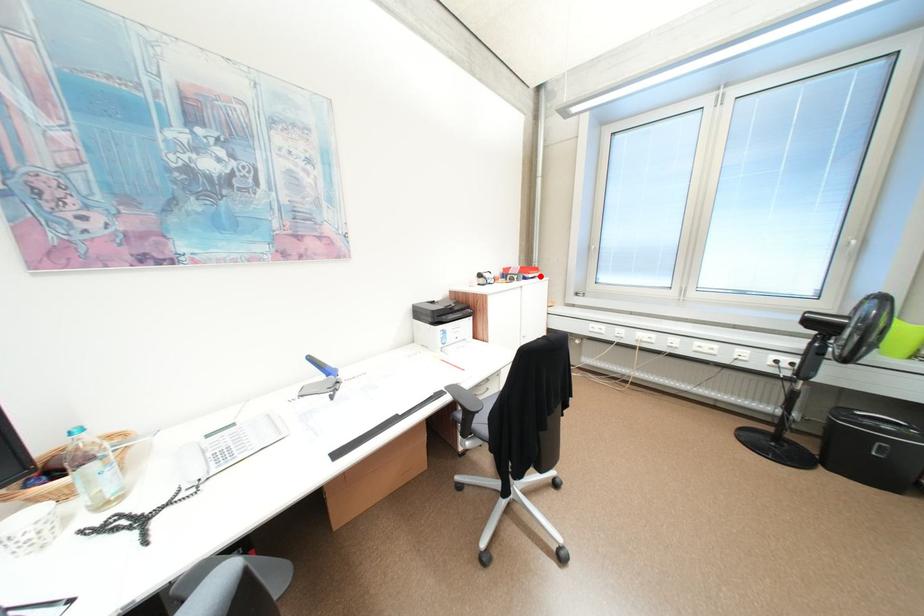
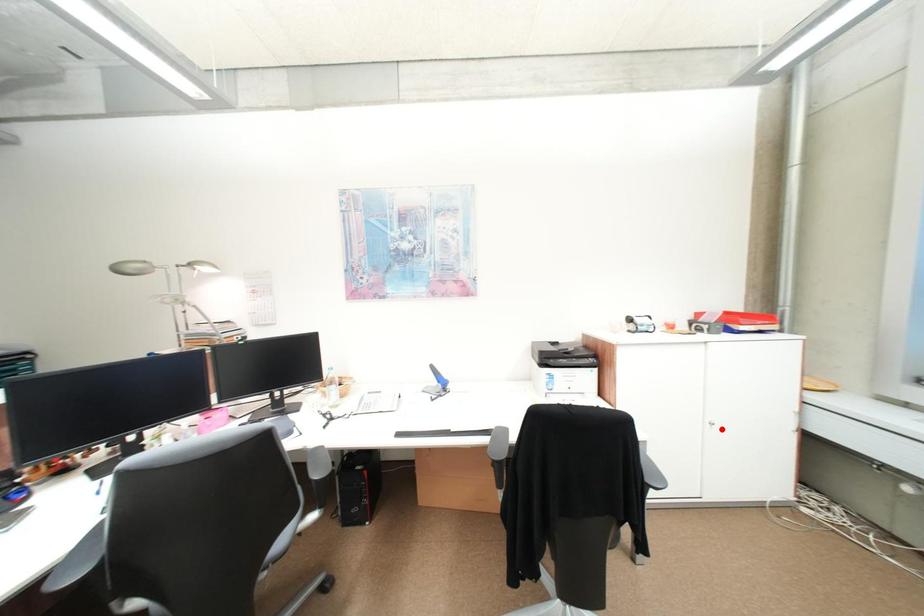
I am providing you with two images of the same scene from different viewpoints. A red point is marked on the first image and another point is marked on the second image. Is the red point in image1 aligned with the point shown in image2?

No